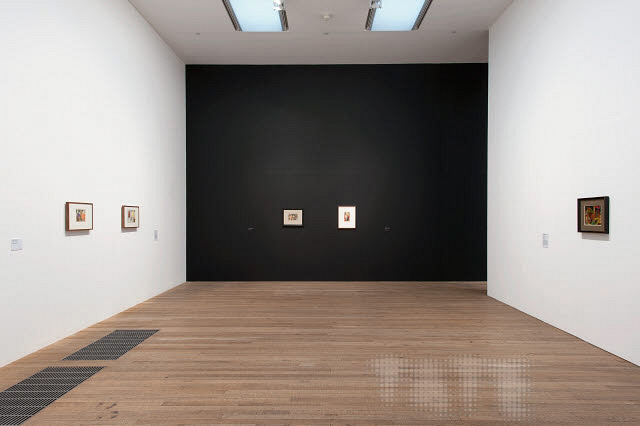
I want to click on 2 vents, so click(x=44, y=384), click(x=116, y=334).